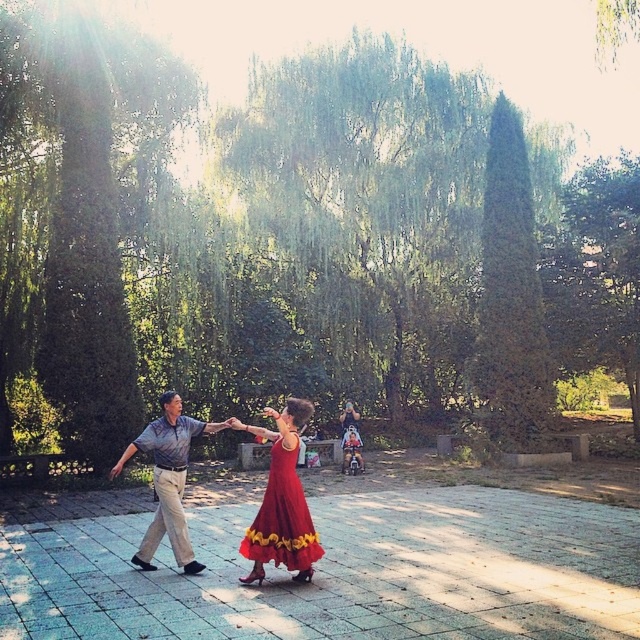
Does point (291, 544) come in front of point (148, 534)?

Yes, point (291, 544) is in front of point (148, 534).

Can you confirm if shiny red dress at center is shorter than gray cotton shirt at center?

Yes, shiny red dress at center is shorter than gray cotton shirt at center.

Identify the location of shiny red dress at center. Image resolution: width=640 pixels, height=640 pixels. (282, 500).